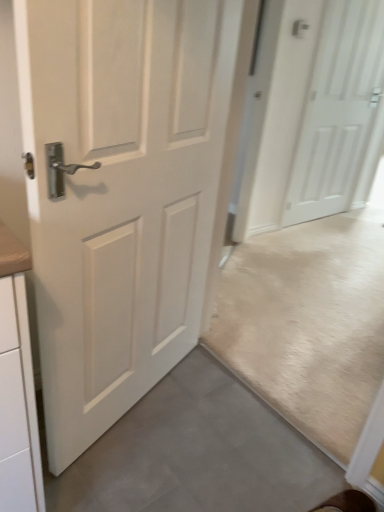
Question: Does point (195, 196) appear closer or farther from the camera than point (382, 58)?

Choices:
 (A) farther
 (B) closer

Answer: (B)

Question: Based on their positions, is white matte door at center, the 2th door viewed from the right, located to the left or right of white matte door at upper right, which ranks as the second door in front-to-back order?

Choices:
 (A) left
 (B) right

Answer: (A)

Question: Looking at their shapes, would you say white matte door at center, the first door when ordered from front to back, is wider or thinner than white matte door at upper right, which appears as the 1th door when viewed from the back?

Choices:
 (A) wide
 (B) thin

Answer: (A)

Question: Considering the positions of white matte door at upper right, the first door from the right, and white matte door at center, the 2th door viewed from the right, in the image, is white matte door at upper right, the first door from the right, wider or thinner than white matte door at center, the 2th door viewed from the right,?

Choices:
 (A) thin
 (B) wide

Answer: (A)

Question: Is point (304, 219) positioned closer to the camera than point (140, 256)?

Choices:
 (A) farther
 (B) closer

Answer: (A)

Question: Is white matte door at upper right, which ranks as the second door in front-to-back order, taller or shorter than white matte door at center, the 2th door viewed from the right?

Choices:
 (A) tall
 (B) short

Answer: (A)

Question: From the image's perspective, is white matte door at upper right, the 2th door positioned from the left, positioned above or below white matte door at center, which appears as the 2th door when viewed from the back?

Choices:
 (A) above
 (B) below

Answer: (A)